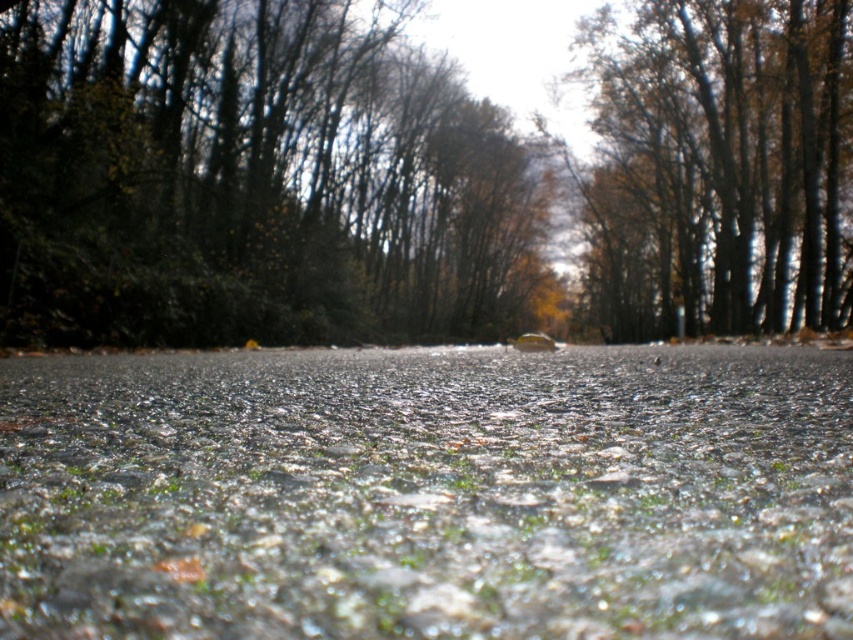
Who is positioned more to the left, dark green leafy tree at center or brown wood tree at upper right?

Positioned to the left is dark green leafy tree at center.

Consider the image. Is dark green leafy tree at center positioned before brown wood tree at upper right?

Yes, dark green leafy tree at center is closer to the viewer.

Where is `dark green leafy tree at center`? dark green leafy tree at center is located at coordinates (254, 180).

What are the coordinates of `dark green leafy tree at center` in the screenshot? It's located at (254, 180).